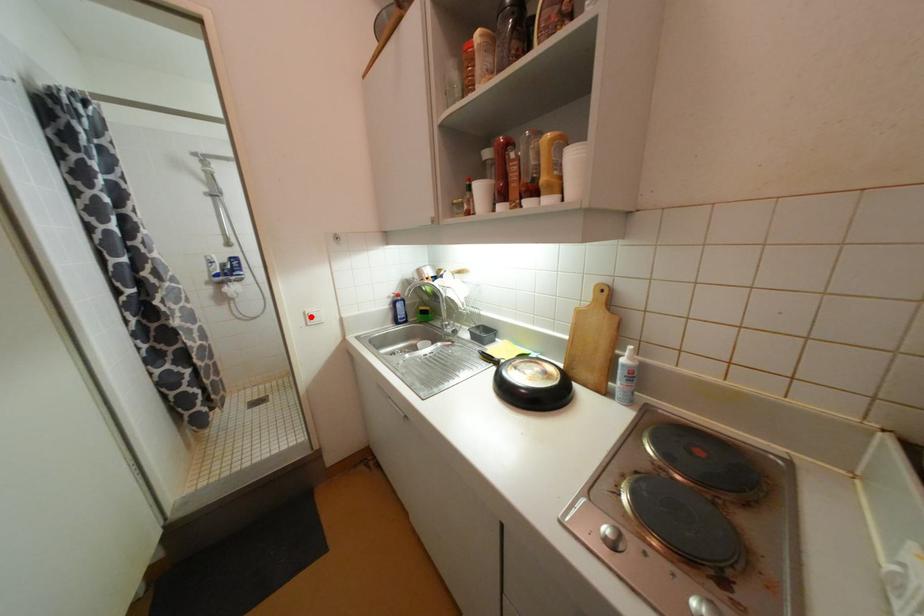
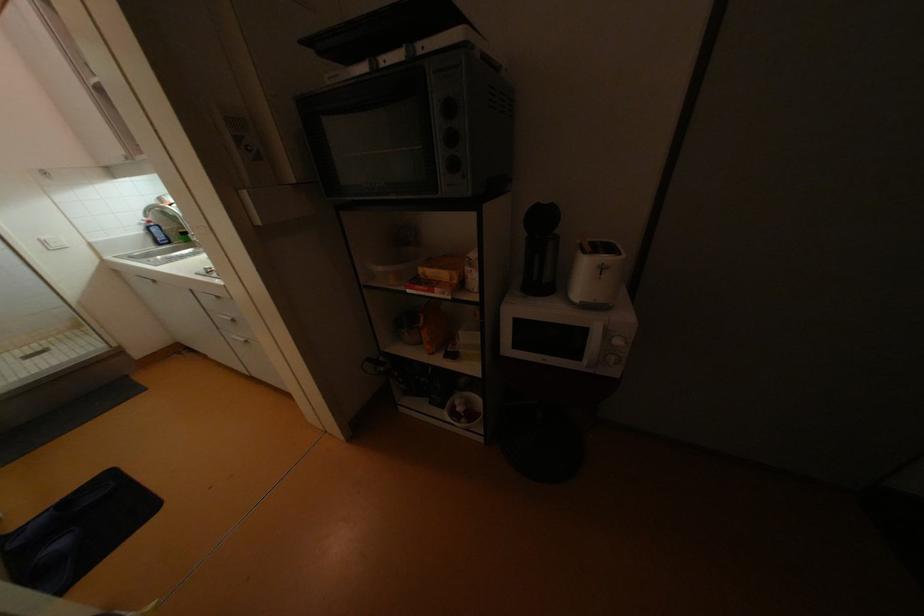
In the second image, find the point that corresponds to the highlighted location in the first image.

(49, 243)